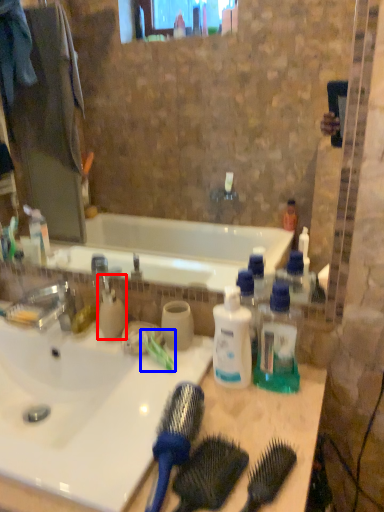
Question: Which object appears farthest to the camera in this image, cleaning product (highlighted by a red box) or toothbrush (highlighted by a blue box)?

Choices:
 (A) cleaning product
 (B) toothbrush

Answer: (A)